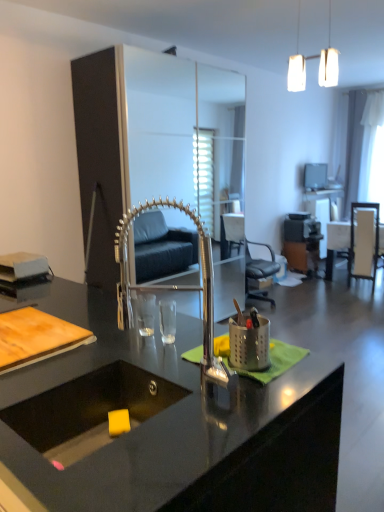
Question: Is wooden chair at right, the 2th chair in the left-to-right sequence, thinner than white glossy table at right, positioned as the second table in back-to-front order?

Choices:
 (A) yes
 (B) no

Answer: (A)

Question: Can you confirm if wooden chair at right, marked as the 1th chair in a right-to-left arrangement, is wider than white glossy table at right, positioned as the second table in back-to-front order?

Choices:
 (A) no
 (B) yes

Answer: (A)

Question: Is wooden chair at right, the 2th chair in the left-to-right sequence, touching white glossy table at right, which is counted as the 1th table, starting from the front?

Choices:
 (A) yes
 (B) no

Answer: (B)

Question: Can you confirm if wooden chair at right, marked as the 1th chair in a right-to-left arrangement, is bigger than white glossy table at right, positioned as the second table in back-to-front order?

Choices:
 (A) no
 (B) yes

Answer: (A)

Question: Is wooden chair at right, marked as the 1th chair in a right-to-left arrangement, not inside white glossy table at right, positioned as the second table in back-to-front order?

Choices:
 (A) yes
 (B) no

Answer: (B)

Question: From a real-world perspective, is matte silver television at upper right above or below white matte pendant lights at upper center?

Choices:
 (A) above
 (B) below

Answer: (B)

Question: Choose the correct answer: Is matte silver television at upper right inside white matte pendant lights at upper center or outside it?

Choices:
 (A) outside
 (B) inside

Answer: (A)

Question: Would you say matte silver television at upper right is to the left or to the right of white matte pendant lights at upper center in the picture?

Choices:
 (A) right
 (B) left

Answer: (A)

Question: Is matte silver television at upper right in front of or behind white matte pendant lights at upper center in the image?

Choices:
 (A) front
 (B) behind

Answer: (B)

Question: Is point (322, 243) closer or farther from the camera than point (228, 380)?

Choices:
 (A) farther
 (B) closer

Answer: (A)

Question: Which is correct: white glossy table at right, acting as the first table starting from the back, is inside polished chrome faucet at center, or outside of it?

Choices:
 (A) outside
 (B) inside

Answer: (A)

Question: Considering the positions of white glossy table at right, the 2th table in the front-to-back sequence, and polished chrome faucet at center in the image, is white glossy table at right, the 2th table in the front-to-back sequence, taller or shorter than polished chrome faucet at center?

Choices:
 (A) tall
 (B) short

Answer: (A)

Question: Relative to polished chrome faucet at center, is white glossy table at right, the 2th table in the front-to-back sequence, in front or behind?

Choices:
 (A) behind
 (B) front

Answer: (A)

Question: In the image, is metallic brown computer desk at center positioned in front of or behind black leather chair at center, which is the 2th chair in right-to-left order?

Choices:
 (A) front
 (B) behind

Answer: (B)

Question: Do you think metallic brown computer desk at center is within black leather chair at center, acting as the 1th chair starting from the left, or outside of it?

Choices:
 (A) outside
 (B) inside

Answer: (A)